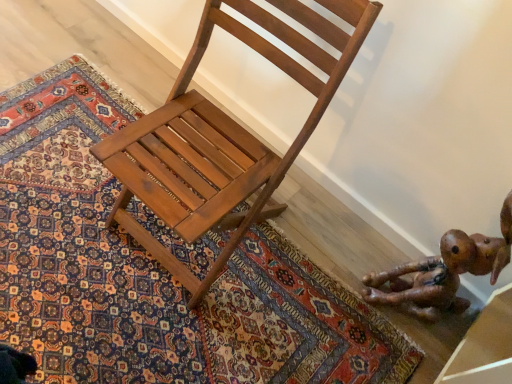
What are the coordinates of `free space above carpeted rug at center (from a real-world perspective)` in the screenshot? It's located at (125, 286).